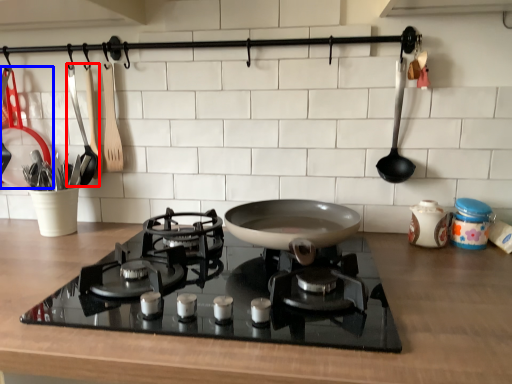
Question: Which object appears farthest to the camera in this image, kitchen appliance (highlighted by a red box) or kitchen appliance (highlighted by a blue box)?

Choices:
 (A) kitchen appliance
 (B) kitchen appliance

Answer: (A)